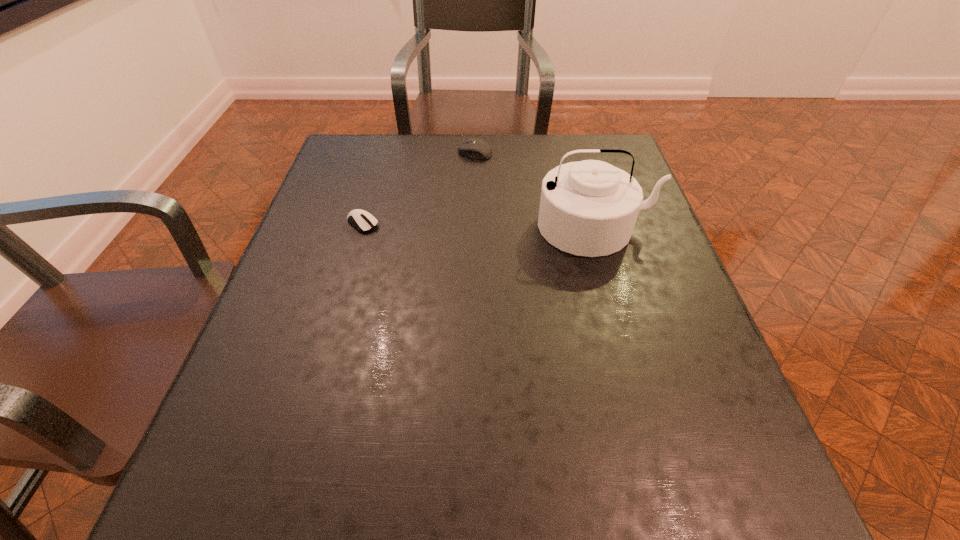
Locate an element on the screen. The image size is (960, 540). object identified as the closest to the second object from right to left is located at coordinates (589, 208).

Identify which object is the closest to the tallest object. Please provide its 2D coordinates. Your answer should be formatted as a tuple, i.e. [(x, y)], where the tuple contains the x and y coordinates of a point satisfying the conditions above.

[(475, 148)]